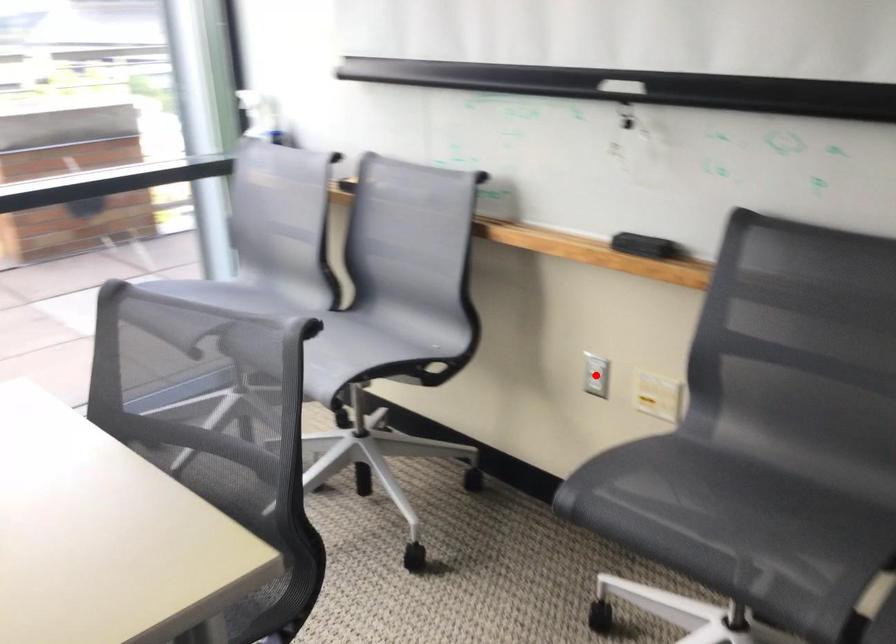
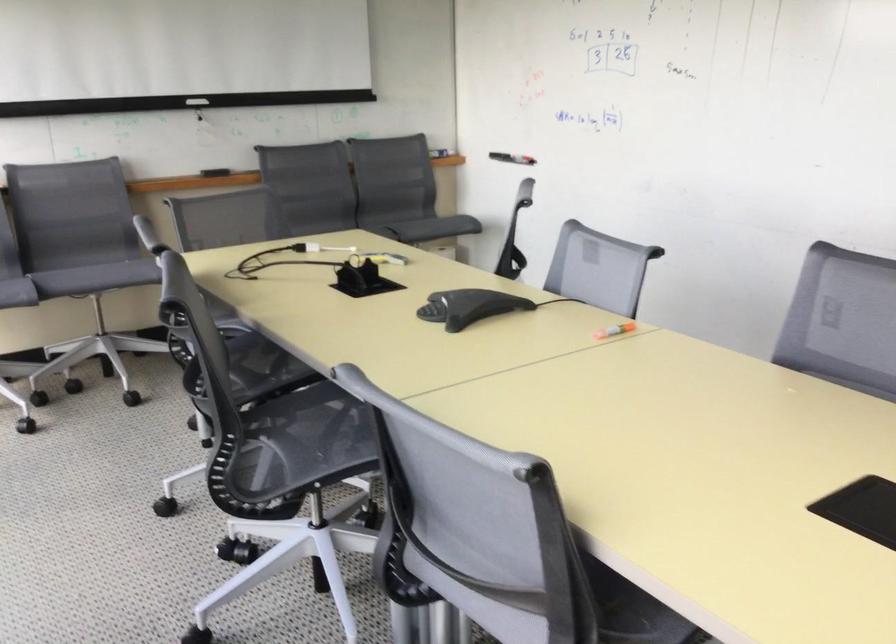
Question: I am providing you with two images of the same scene from different viewpoints. A red point is marked on the first image. At the location where the point appears in image 1, is it still visible in image 2?

Choices:
 (A) Yes
 (B) No

Answer: (B)